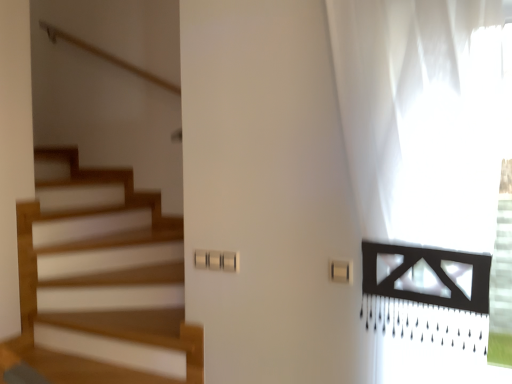
In order to face white sheer curtain at right, should I rotate leftwards or rightwards?

Rotate right and turn 18.957 degrees.

Measure the distance between point (455,146) and camera.

A distance of 1.36 meters exists between point (455,146) and camera.

Identify the location of white sheer curtain at right. (421, 117).

Image resolution: width=512 pixels, height=384 pixels. Describe the element at coordinates (421, 117) in the screenshot. I see `white sheer curtain at right` at that location.

Find the location of a particular element. white plastic light switch at center is located at coordinates (341, 271).

Describe the element at coordinates (341, 271) in the screenshot. The image size is (512, 384). I see `white plastic light switch at center` at that location.

In the scene shown: What is the approximate width of white plastic light switch at center?

white plastic light switch at center is 0.76 inches wide.

Find the location of a particular element. This screenshot has width=512, height=384. white sheer curtain at right is located at coordinates (421, 117).

Considering the relative positions of white plastic light switch at center and white sheer curtain at right in the image provided, is white plastic light switch at center to the left or to the right of white sheer curtain at right?

white plastic light switch at center is to the left of white sheer curtain at right.

Considering the positions of objects white plastic light switch at center and white sheer curtain at right in the image provided, who is behind, white plastic light switch at center or white sheer curtain at right?

white plastic light switch at center is more distant.

Does point (338, 277) lie behind point (479, 162)?

Yes, it is.

From the image's perspective, who appears lower, white plastic light switch at center or white sheer curtain at right?

white plastic light switch at center, from the image's perspective.

From a real-world perspective, which is physically below, white plastic light switch at center or white sheer curtain at right?

white plastic light switch at center.

Which of these two, white plastic light switch at center or white sheer curtain at right, is wider?

white sheer curtain at right is wider.

Who is taller, white plastic light switch at center or white sheer curtain at right?

white sheer curtain at right is taller.

Looking at the image, does white plastic light switch at center seem bigger or smaller compared to white sheer curtain at right?

Clearly, white plastic light switch at center is smaller in size than white sheer curtain at right.

Would you say white plastic light switch at center contains white sheer curtain at right?

No, white sheer curtain at right is not inside white plastic light switch at center.

Is white plastic light switch at center with white sheer curtain at right?

No, white plastic light switch at center is not with white sheer curtain at right.

Could you tell me if white plastic light switch at center is turned towards white sheer curtain at right?

Yes, white plastic light switch at center is turned towards white sheer curtain at right.

You are a GUI agent. You are given a task and a screenshot of the screen. Output one action in this format:
    pyautogui.click(x=<x>, y=<y>)
    Task: Click on the light switch below the white sheer curtain at right (from a real-world perspective)
    This screenshot has height=384, width=512.
    Given the screenshot: What is the action you would take?
    pyautogui.click(x=341, y=271)

Which is more to the left, white sheer curtain at right or white plastic light switch at center?

From the viewer's perspective, white plastic light switch at center appears more on the left side.

Which object is closer to the camera, white sheer curtain at right or white plastic light switch at center?

white sheer curtain at right is in front.

Is point (405, 41) positioned behind point (338, 273)?

No.

From the image's perspective, relative to white plastic light switch at center, is white sheer curtain at right above or below?

From the image's perspective, white sheer curtain at right appears above white plastic light switch at center.

From a real-world perspective, relative to white plastic light switch at center, is white sheer curtain at right vertically above or below?

Clearly, from a real-world perspective, white sheer curtain at right is above white plastic light switch at center.

Considering the sizes of objects white sheer curtain at right and white plastic light switch at center in the image provided, who is thinner, white sheer curtain at right or white plastic light switch at center?

Thinner between the two is white plastic light switch at center.

Does white sheer curtain at right have a lesser height compared to white plastic light switch at center?

No, white sheer curtain at right is not shorter than white plastic light switch at center.

Looking at this image, does white sheer curtain at right have a larger size compared to white plastic light switch at center?

Correct, white sheer curtain at right is larger in size than white plastic light switch at center.

Does white sheer curtain at right contain white plastic light switch at center?

No, white plastic light switch at center is located outside of white sheer curtain at right.

Would you say white sheer curtain at right is a long distance from white plastic light switch at center?

white sheer curtain at right is near white plastic light switch at center, not far away.

Is white plastic light switch at center at the back of white sheer curtain at right?

Yes, white plastic light switch at center is at the back of white sheer curtain at right.

Can you tell me how much white sheer curtain at right and white plastic light switch at center differ in facing direction?

0.395 degrees.

Measure the distance from white sheer curtain at right to white plastic light switch at center.

A distance of 56.37 centimeters exists between white sheer curtain at right and white plastic light switch at center.

Identify the location of light switch on the left of the white sheer curtain at right. The image size is (512, 384). (341, 271).

You are a GUI agent. You are given a task and a screenshot of the screen. Output one action in this format:
    pyautogui.click(x=<x>, y=<y>)
    Task: Click on the curtain in front of the white plastic light switch at center
    
    Given the screenshot: What is the action you would take?
    pyautogui.click(x=421, y=117)

You are a GUI agent. You are given a task and a screenshot of the screen. Output one action in this format:
    pyautogui.click(x=<x>, y=<y>)
    Task: Click on the light switch directly beneath the white sheer curtain at right (from a real-world perspective)
    The width and height of the screenshot is (512, 384).
    Given the screenshot: What is the action you would take?
    pyautogui.click(x=341, y=271)